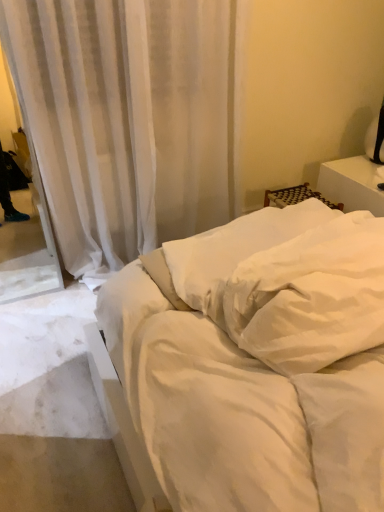
Question: Based on their sizes in the image, would you say white smooth bed at center is bigger or smaller than white soft pillow at center, placed as the first pillow when sorted from front to back?

Choices:
 (A) big
 (B) small

Answer: (A)

Question: From a real-world perspective, is white smooth bed at center above or below white soft pillow at center, placed as the second pillow when sorted from back to front?

Choices:
 (A) above
 (B) below

Answer: (B)

Question: Which object is positioned closest to the white soft pillow at center, placed as the first pillow when sorted from front to back?

Choices:
 (A) white sheer curtain at upper center
 (B) white smooth bed at center
 (C) white soft pillow at center, the first pillow positioned from the back

Answer: (B)

Question: Estimate the real-world distances between objects in this image. Which object is farther from the white smooth bed at center?

Choices:
 (A) white soft pillow at center, the second pillow in the front-to-back sequence
 (B) white sheer curtain at upper center
 (C) white soft pillow at center, placed as the first pillow when sorted from front to back

Answer: (B)